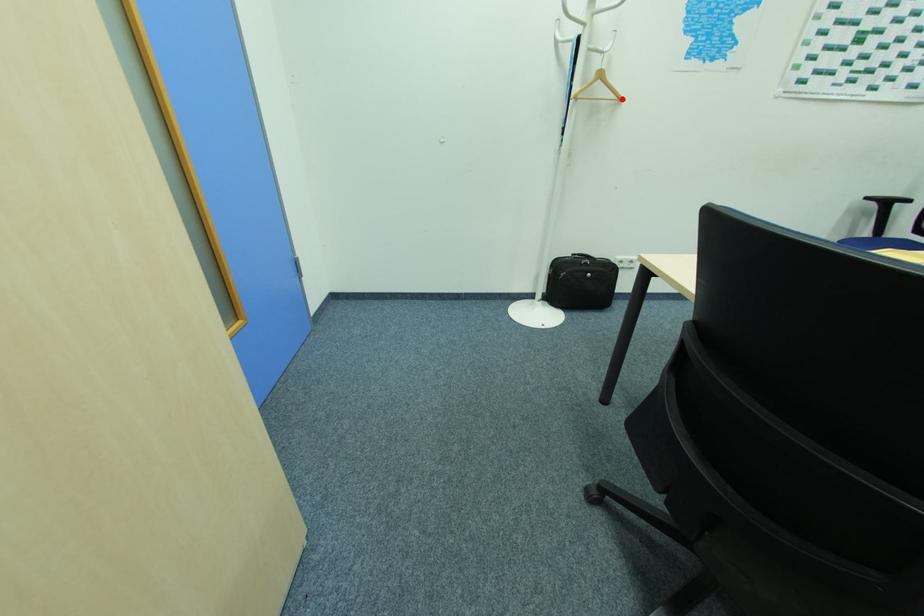
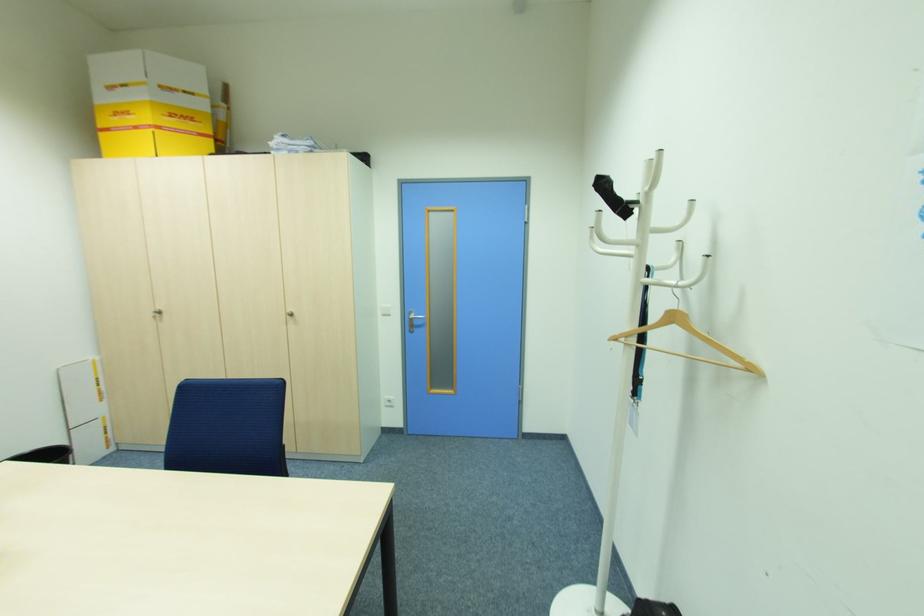
Where in the second image is the point corresponding to the highlighted location from the first image?

(756, 370)